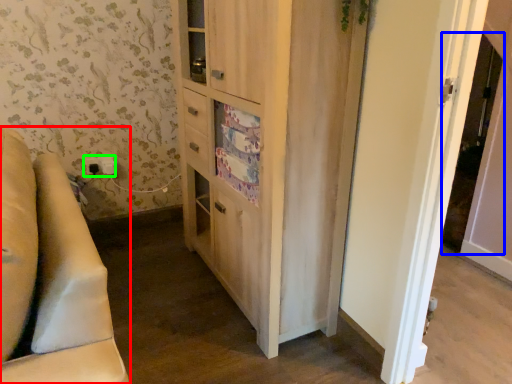
Question: Which object is the closest to the furniture (highlighted by a red box)? Choose among these: screen door (highlighted by a blue box) or electric outlet (highlighted by a green box).

Choices:
 (A) screen door
 (B) electric outlet

Answer: (B)